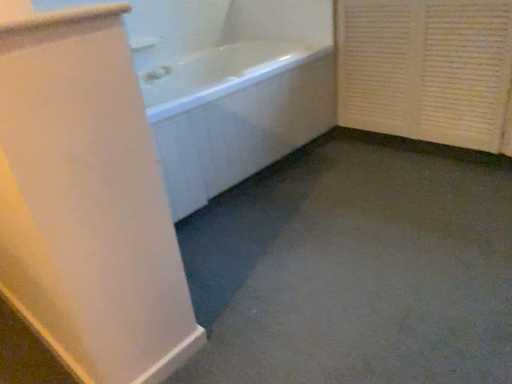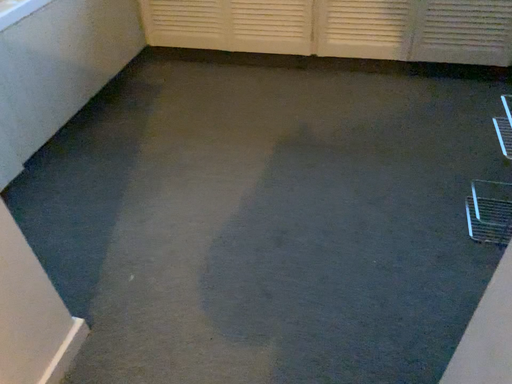
Question: Which way did the camera rotate in the video?

Choices:
 (A) rotated upward
 (B) rotated downward

Answer: (B)